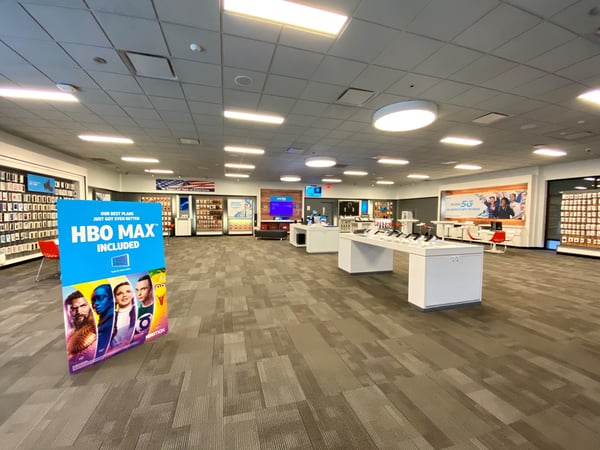
Image resolution: width=600 pixels, height=450 pixels. I want to click on displays, so click(x=406, y=249), click(x=323, y=231), click(x=584, y=216), click(x=377, y=211), click(x=349, y=212), click(x=210, y=214), click(x=167, y=212), click(x=32, y=223).